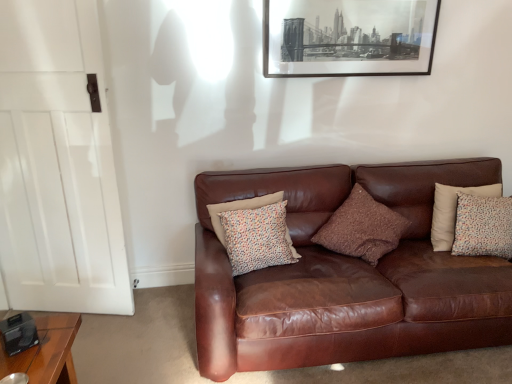
Image resolution: width=512 pixels, height=384 pixels. What are the coordinates of `blank space situated above brown wooden table at lower left (from a real-world perspective)` in the screenshot? It's located at (27, 346).